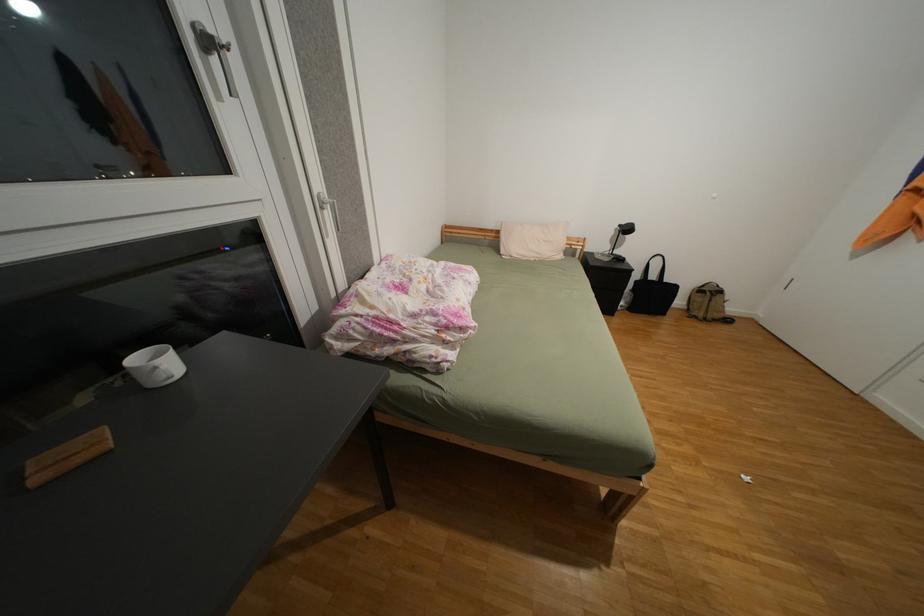
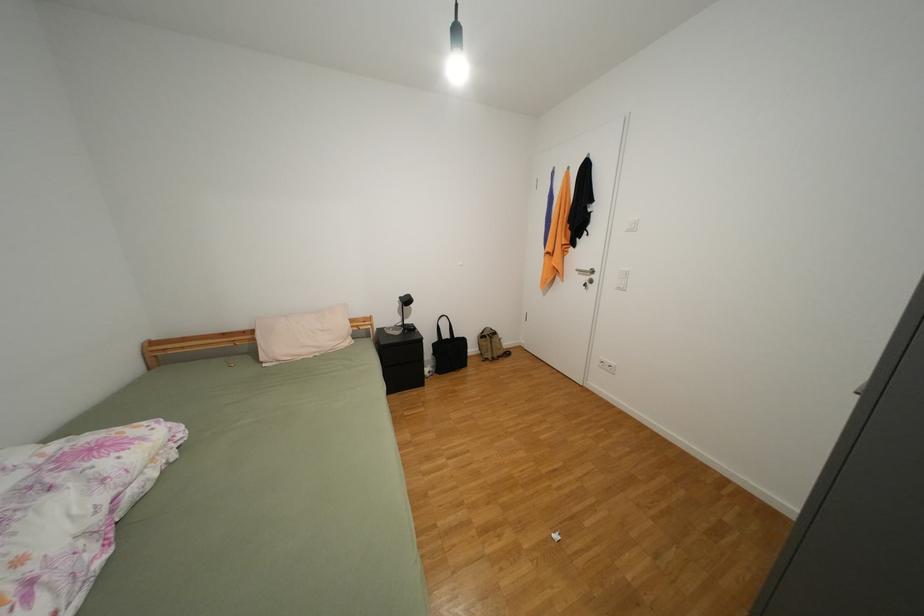
Question: The images are taken continuously from a first-person perspective. In which direction is your viewpoint rotating?

Choices:
 (A) Left
 (B) Right
 (C) Up
 (D) Down

Answer: (B)